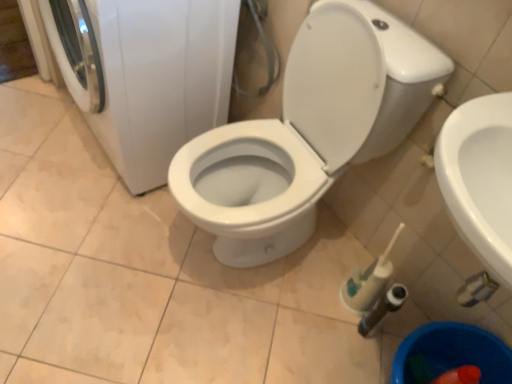
Find the location of a particular element. white glossy washing machine at left is located at coordinates (149, 76).

Describe the element at coordinates (149, 76) in the screenshot. Image resolution: width=512 pixels, height=384 pixels. I see `white glossy washing machine at left` at that location.

Find the location of a particular element. white glossy toilet at center is located at coordinates (308, 131).

Measure the distance between point (403, 135) and camera.

The depth of point (403, 135) is 3.80 feet.

In order to face white glossy toilet at center, should I rotate leftwards or rightwards?

Turn right approximately 2.503 degrees to face it.

What do you see at coordinates (308, 131) in the screenshot? This screenshot has width=512, height=384. I see `white glossy toilet at center` at bounding box center [308, 131].

I want to click on white glossy washing machine at left, so click(x=149, y=76).

Can you confirm if white glossy toilet at center is positioned to the left of white glossy washing machine at left?

No.

Looking at this image, considering their positions, is white glossy toilet at center located in front of or behind white glossy washing machine at left?

white glossy toilet at center is positioned closer to the viewer than white glossy washing machine at left.

Does point (321, 135) come behind point (106, 108)?

No, (321, 135) is closer to viewer.

From the image's perspective, is white glossy toilet at center beneath white glossy washing machine at left?

Yes, from the image's perspective, white glossy toilet at center is below white glossy washing machine at left.

From a real-world perspective, who is located higher, white glossy toilet at center or white glossy washing machine at left?

In real-world perspective, white glossy toilet at center is above.

Is white glossy toilet at center wider than white glossy washing machine at left?

Yes, white glossy toilet at center is wider than white glossy washing machine at left.

From their relative heights in the image, would you say white glossy toilet at center is taller or shorter than white glossy washing machine at left?

Clearly, white glossy toilet at center is taller compared to white glossy washing machine at left.

Is white glossy toilet at center bigger than white glossy washing machine at left?

No.

Do you think white glossy toilet at center is within white glossy washing machine at left, or outside of it?

white glossy toilet at center is not inside white glossy washing machine at left, it's outside.

Are white glossy toilet at center and white glossy washing machine at left making contact?

No, white glossy toilet at center is not next to white glossy washing machine at left.

Could you tell me if white glossy toilet at center is facing white glossy washing machine at left?

No, white glossy toilet at center is not turned towards white glossy washing machine at left.

How different are the orientations of white glossy toilet at center and white glossy washing machine at left in degrees?

The angle between the facing direction of white glossy toilet at center and the facing direction of white glossy washing machine at left is 0.485 degrees.

This screenshot has width=512, height=384. In the image, there is a white glossy toilet at center. Find the location of `washing machine above it (from the image's perspective)`. washing machine above it (from the image's perspective) is located at coordinates (149, 76).

Considering the relative positions of white glossy washing machine at left and white glossy toilet at center in the image provided, is white glossy washing machine at left to the left of white glossy toilet at center from the viewer's perspective?

Yes, white glossy washing machine at left is to the left of white glossy toilet at center.

Does white glossy washing machine at left come in front of white glossy toilet at center?

No.

Is point (106, 36) closer or farther from the camera than point (207, 155)?

Point (106, 36).

From the image's perspective, between white glossy washing machine at left and white glossy toilet at center, who is located below?

white glossy toilet at center.

From a real-world perspective, is white glossy washing machine at left positioned above or below white glossy toilet at center?

From a real-world perspective, white glossy washing machine at left is physically below white glossy toilet at center.

Considering the sizes of objects white glossy washing machine at left and white glossy toilet at center in the image provided, who is wider, white glossy washing machine at left or white glossy toilet at center?

With larger width is white glossy toilet at center.

Considering the relative sizes of white glossy washing machine at left and white glossy toilet at center in the image provided, is white glossy washing machine at left shorter than white glossy toilet at center?

Correct, white glossy washing machine at left is not as tall as white glossy toilet at center.

Does white glossy washing machine at left have a larger size compared to white glossy toilet at center?

Indeed, white glossy washing machine at left has a larger size compared to white glossy toilet at center.

Do you think white glossy washing machine at left is within white glossy toilet at center, or outside of it?

white glossy washing machine at left cannot be found inside white glossy toilet at center.

Is white glossy washing machine at left far from white glossy toilet at center?

white glossy washing machine at left is actually quite close to white glossy toilet at center.

Is white glossy washing machine at left positioned with its back to white glossy toilet at center?

white glossy washing machine at left does not have its back to white glossy toilet at center.

How different are the orientations of white glossy washing machine at left and white glossy toilet at center in degrees?

white glossy washing machine at left and white glossy toilet at center are facing 0.485 degrees away from each other.

The height and width of the screenshot is (384, 512). In the image, there is a white glossy toilet at center. Identify the location of washing machine below it (from a real-world perspective). (149, 76).

At what (x,y) coordinates should I click in order to perform the action: click on washing machine below the white glossy toilet at center (from a real-world perspective). Please return your answer as a coordinate pair (x, y). Looking at the image, I should click on (149, 76).

The width and height of the screenshot is (512, 384). In order to click on toilet in front of the white glossy washing machine at left in this screenshot , I will do `click(308, 131)`.